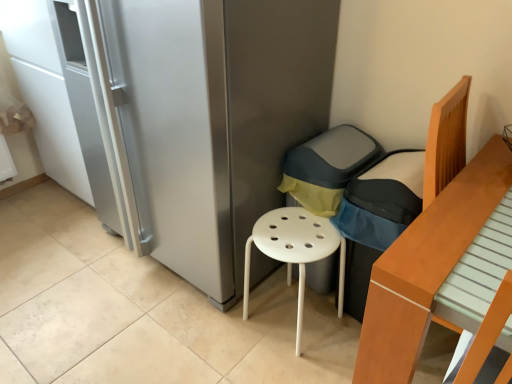
What do you see at coordinates (201, 121) in the screenshot? The image size is (512, 384). I see `satin silver fridge at center` at bounding box center [201, 121].

Measure the distance between point (432, 181) and camera.

Point (432, 181) and camera are 1.25 meters apart from each other.

In order to face dark gray fabric armchair at center, should I rotate leftwards or rightwards?

You should look right and rotate roughly 17.343 degrees.

At what (x,y) coordinates should I click in order to perform the action: click on white plastic stool at center. Please return your answer as a coordinate pair (x, y). This screenshot has height=384, width=512. Looking at the image, I should click on (295, 250).

Between point (264, 168) and point (465, 121), which one is positioned behind?

The point (264, 168) is farther.

Can you confirm if satin silver fridge at center is thinner than dark gray fabric armchair at center?

Incorrect, the width of satin silver fridge at center is not less than that of dark gray fabric armchair at center.

Can you tell me how much satin silver fridge at center and dark gray fabric armchair at center differ in facing direction?

The facing directions of satin silver fridge at center and dark gray fabric armchair at center are 1.45 degrees apart.

Can we say satin silver fridge at center lies outside dark gray fabric armchair at center?

satin silver fridge at center lies outside dark gray fabric armchair at center's area.

From a real-world perspective, is light brown wooden bed at right on top of dark gray fabric armchair at center?

Yes, from a real-world perspective, light brown wooden bed at right is above dark gray fabric armchair at center.

Would you say light brown wooden bed at right is outside dark gray fabric armchair at center?

Yes, light brown wooden bed at right is outside of dark gray fabric armchair at center.

Looking at this image, is light brown wooden bed at right wider than dark gray fabric armchair at center?

Indeed, light brown wooden bed at right has a greater width compared to dark gray fabric armchair at center.

Considering the relative positions of light brown wooden bed at right and dark gray fabric armchair at center in the image provided, is light brown wooden bed at right to the left of dark gray fabric armchair at center from the viewer's perspective?

No.

Can you confirm if light brown wooden bed at right is wider than satin silver fridge at center?

No, light brown wooden bed at right is not wider than satin silver fridge at center.

Which is in front, light brown wooden bed at right or satin silver fridge at center?

light brown wooden bed at right.

Choose the correct answer: Is light brown wooden bed at right inside satin silver fridge at center or outside it?

light brown wooden bed at right is located beyond the bounds of satin silver fridge at center.

Is light brown wooden bed at right facing towards satin silver fridge at center?

No, light brown wooden bed at right is not turned towards satin silver fridge at center.

Is white plastic stool at center looking in the opposite direction of light brown wooden bed at right?

No, white plastic stool at center is not facing the opposite direction of light brown wooden bed at right.

From the picture: Who is smaller, white plastic stool at center or light brown wooden bed at right?

With smaller size is white plastic stool at center.

Locate an element on the screen. The image size is (512, 384). stool above the light brown wooden bed at right (from the image's perspective) is located at coordinates (295, 250).

From the image's perspective, which one is positioned higher, white plastic stool at center or light brown wooden bed at right?

white plastic stool at center is shown above in the image.

From the image's perspective, which object appears higher, dark gray fabric armchair at center or light brown wooden bed at right?

dark gray fabric armchair at center.

Can you confirm if dark gray fabric armchair at center is thinner than light brown wooden bed at right?

Yes, dark gray fabric armchair at center is thinner than light brown wooden bed at right.

Can light brown wooden bed at right be found inside dark gray fabric armchair at center?

That's incorrect, light brown wooden bed at right is not inside dark gray fabric armchair at center.

Would you say dark gray fabric armchair at center is a long distance from light brown wooden bed at right?

dark gray fabric armchair at center is actually quite close to light brown wooden bed at right.

From a real-world perspective, is light brown wooden bed at right physically located above or below white plastic stool at center?

light brown wooden bed at right is above white plastic stool at center.

Is light brown wooden bed at right oriented towards white plastic stool at center?

No, light brown wooden bed at right does not turn towards white plastic stool at center.

Image resolution: width=512 pixels, height=384 pixels. Identify the location of furniture below the white plastic stool at center (from the image's perspective). (436, 269).

Based on the photo, does dark gray fabric armchair at center have a lesser height compared to satin silver fridge at center?

Yes.

Does dark gray fabric armchair at center turn towards satin silver fridge at center?

No, dark gray fabric armchair at center does not turn towards satin silver fridge at center.

Is point (425, 171) closer or farther from the camera than point (249, 47)?

Point (425, 171).

Is dark gray fabric armchair at center not close to satin silver fridge at center?

No, there isn't a large distance between dark gray fabric armchair at center and satin silver fridge at center.

Locate an element on the screen. fridge located above the dark gray fabric armchair at center (from a real-world perspective) is located at coordinates (201, 121).

This screenshot has width=512, height=384. In order to click on armchair behind the light brown wooden bed at right in this screenshot , I will do `click(429, 154)`.

Estimate the real-world distances between objects in this image. Which object is further from satin silver fridge at center, white plastic stool at center or dark gray fabric armchair at center?

dark gray fabric armchair at center lies further to satin silver fridge at center than the other object.

When comparing their distances from satin silver fridge at center, does dark gray fabric armchair at center or white plastic stool at center seem closer?

white plastic stool at center lies closer to satin silver fridge at center than the other object.

From the image, which object appears to be farther from dark gray fabric armchair at center, satin silver fridge at center or light brown wooden bed at right?

satin silver fridge at center lies further to dark gray fabric armchair at center than the other object.

Considering their positions, is dark gray fabric armchair at center positioned further to white plastic stool at center than satin silver fridge at center?

Among the two, satin silver fridge at center is located further to white plastic stool at center.

Which object lies further to the anchor point light brown wooden bed at right, white plastic stool at center or satin silver fridge at center?

satin silver fridge at center.

When comparing their distances from white plastic stool at center, does light brown wooden bed at right or dark gray fabric armchair at center seem closer?

dark gray fabric armchair at center.

Which object lies further to the anchor point white plastic stool at center, dark gray fabric armchair at center or light brown wooden bed at right?

light brown wooden bed at right lies further to white plastic stool at center than the other object.

When comparing their distances from satin silver fridge at center, does light brown wooden bed at right or white plastic stool at center seem further?

light brown wooden bed at right is further to satin silver fridge at center.

Locate an element on the screen. The image size is (512, 384). armchair between light brown wooden bed at right and white plastic stool at center from front to back is located at coordinates (429, 154).

At what (x,y) coordinates should I click in order to perform the action: click on armchair between satin silver fridge at center and light brown wooden bed at right in the horizontal direction. Please return your answer as a coordinate pair (x, y). This screenshot has height=384, width=512. Looking at the image, I should click on (429, 154).

The height and width of the screenshot is (384, 512). I want to click on fridge between light brown wooden bed at right and white plastic stool at center along the z-axis, so click(201, 121).

This screenshot has height=384, width=512. What are the coordinates of `stool between satin silver fridge at center and dark gray fabric armchair at center` in the screenshot? It's located at (295, 250).